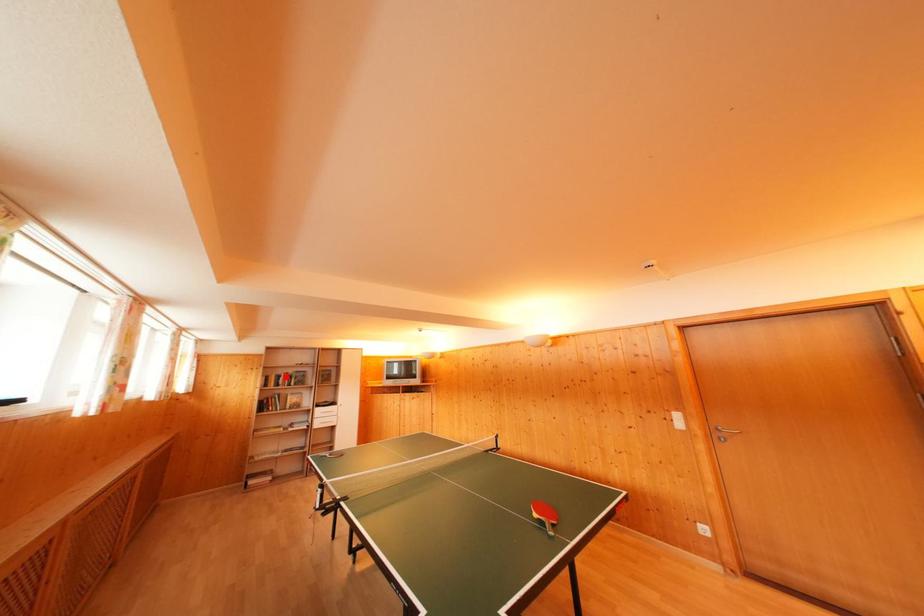
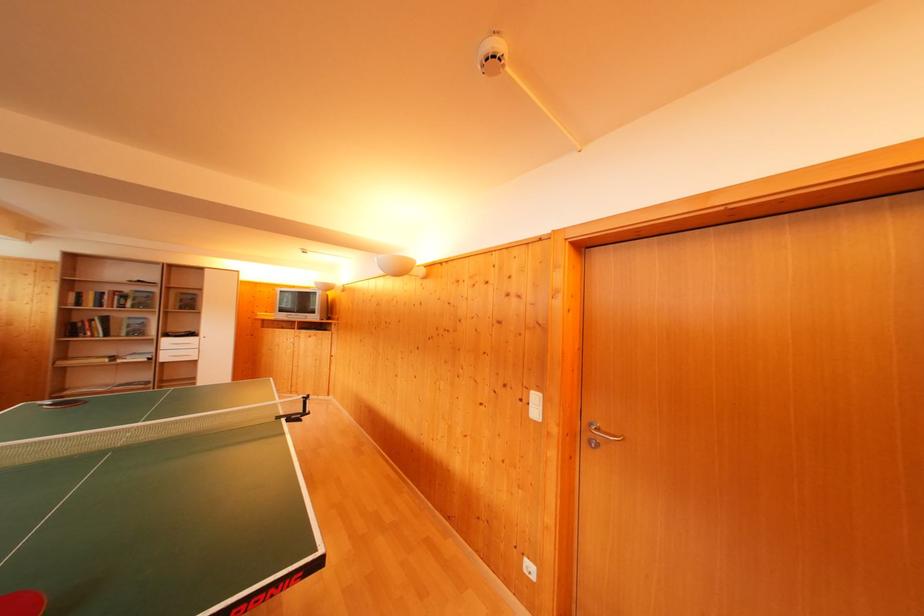
Find the pixel in the second image that matches the highlighted location in the first image.

(112, 294)